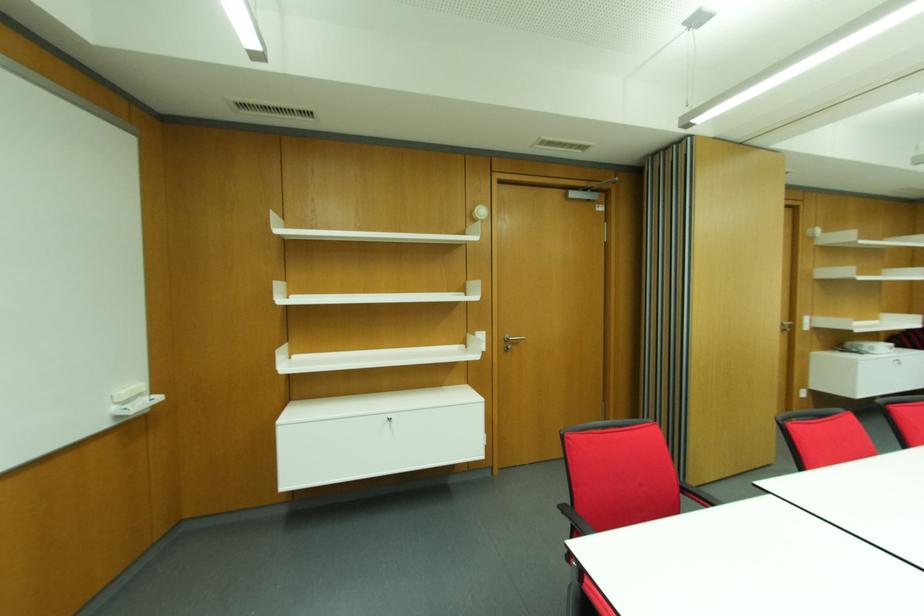
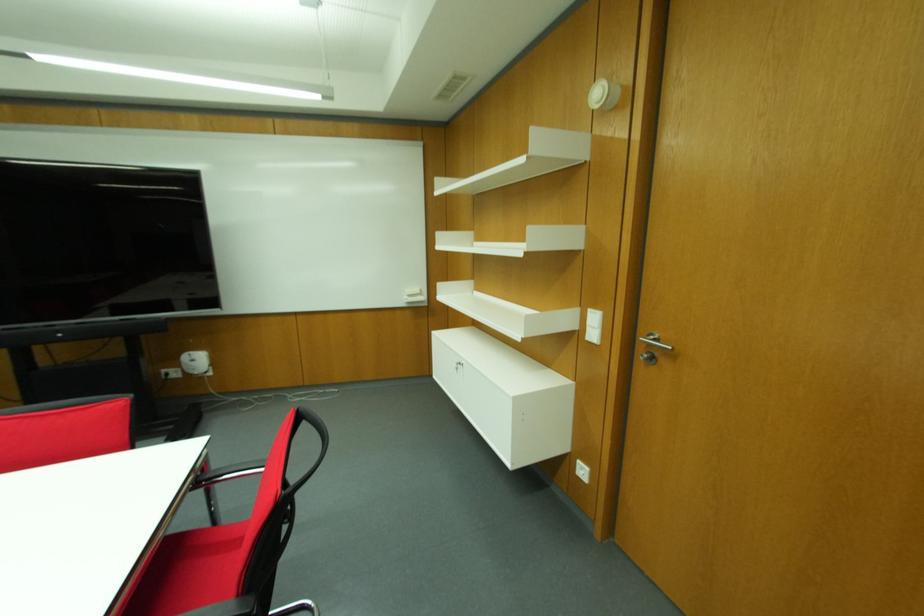
In the second image, find the point that corresponds to [476,331] in the first image.

(589, 310)